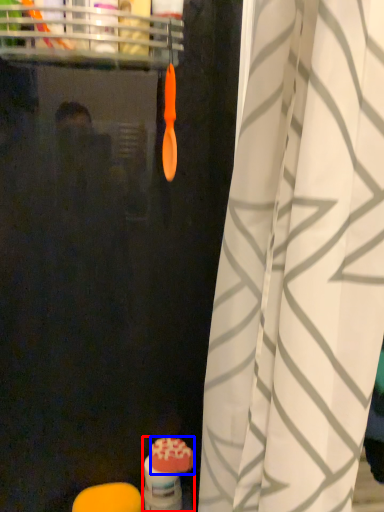
Question: Which point is further to the camera, toiletry (highlighted by a red box) or soap (highlighted by a blue box)?

Choices:
 (A) toiletry
 (B) soap

Answer: (A)